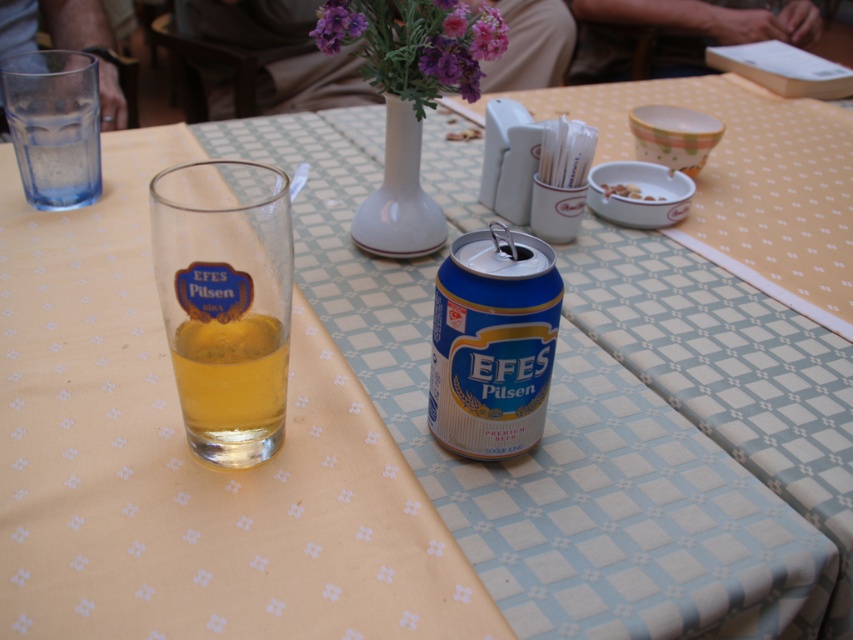
Question: Which object appears farthest from the camera in this image?

Choices:
 (A) white crumbly food at center
 (B) transparent glass at upper left
 (C) purple matte vase at upper center

Answer: (A)

Question: Where is translucent glass at left located in relation to purple matte flowers at upper center in the image?

Choices:
 (A) right
 (B) left

Answer: (B)

Question: Among these objects, which one is farthest from the camera?

Choices:
 (A) white glossy vase at center
 (B) white crumbly food at center
 (C) blue metallic can at center
 (D) purple matte vase at upper center

Answer: (B)

Question: Can you confirm if transparent glass at upper left is positioned above white crumbly food at center?

Choices:
 (A) yes
 (B) no

Answer: (A)

Question: Among these points, which one is farthest from the camera?

Choices:
 (A) (328, 1)
 (B) (256, 412)

Answer: (A)

Question: Where is blue metallic can at center located in relation to white crumbly food at center in the image?

Choices:
 (A) above
 (B) below

Answer: (B)